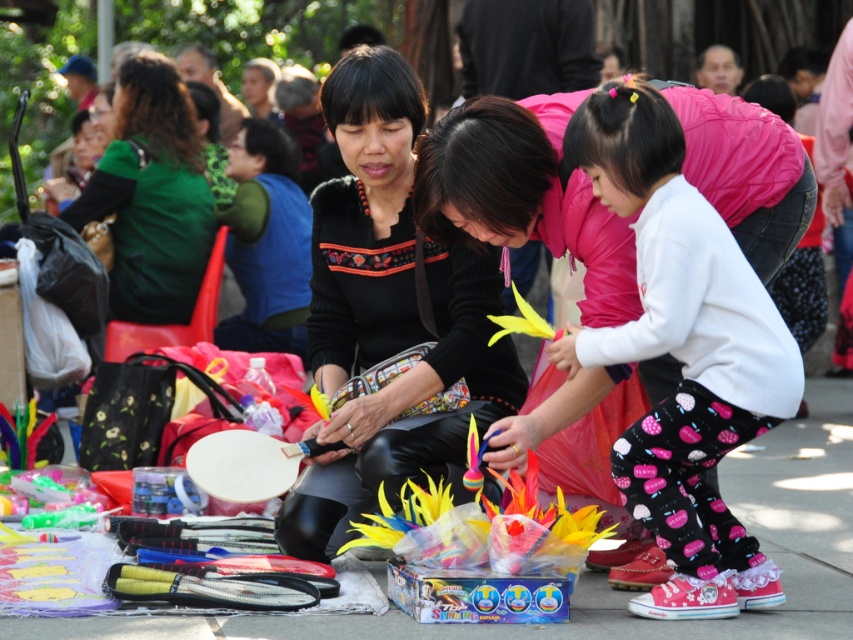
Is white fleece sweater at center further to camera compared to green matte shirt at upper left?

No, white fleece sweater at center is in front of green matte shirt at upper left.

Looking at this image, is white fleece sweater at center in front of green matte shirt at upper left?

That is True.

You are a GUI agent. You are given a task and a screenshot of the screen. Output one action in this format:
    pyautogui.click(x=<x>, y=<y>)
    Task: Click on the white fleece sweater at center
    
    Given the screenshot: What is the action you would take?
    pyautogui.click(x=682, y=355)

Can you confirm if white fleece sweater at center is shorter than black leather jacket at center?

Indeed, white fleece sweater at center has a lesser height compared to black leather jacket at center.

Which is more to the right, white fleece sweater at center or black leather jacket at center?

white fleece sweater at center

Does point (735, 413) come behind point (413, 324)?

No, it is not.

In order to click on white fleece sweater at center in this screenshot , I will do `click(682, 355)`.

Which is more to the left, black leather jacket at center or smooth concrete pavement at center?

From the viewer's perspective, black leather jacket at center appears more on the left side.

Does black leather jacket at center appear under smooth concrete pavement at center?

Actually, black leather jacket at center is above smooth concrete pavement at center.

Between point (361, 182) and point (183, 632), which one is positioned behind?

The point (361, 182) is more distant.

Locate an element on the screen. black leather jacket at center is located at coordinates (387, 312).